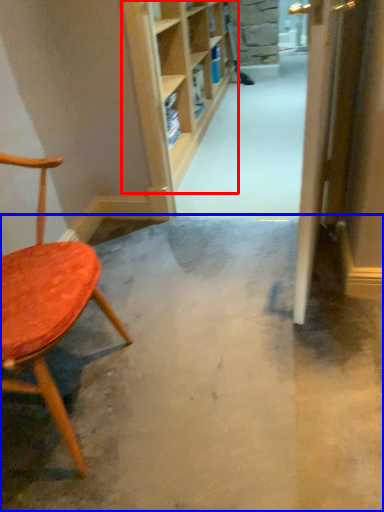
Question: Among these objects, which one is farthest to the camera, shelf (highlighted by a red box) or concrete (highlighted by a blue box)?

Choices:
 (A) shelf
 (B) concrete

Answer: (A)